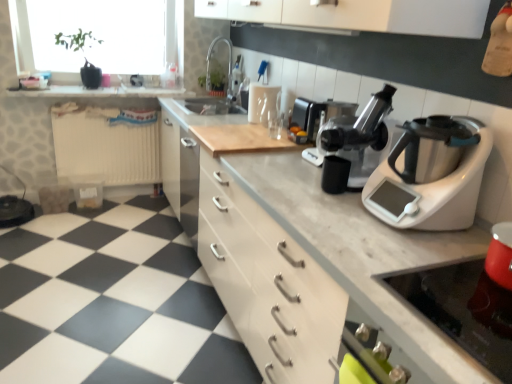
Identify the location of free space in front of silver metallic food processor at right. The image size is (512, 384). (418, 256).